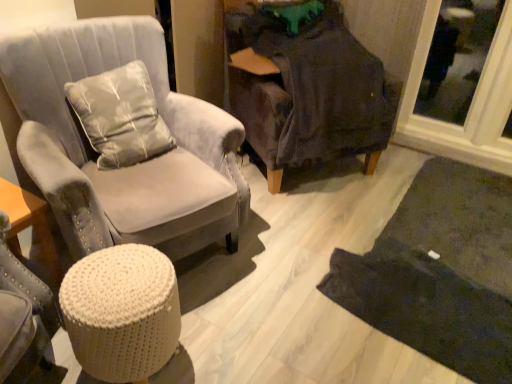
Question: Which direction should I rotate to look at dark gray fabric chair at center, marked as the 1th chair in a right-to-left arrangement, — up or down?

Choices:
 (A) up
 (B) down

Answer: (A)

Question: Can you confirm if white knitted stool at lower left is shorter than satin-like gray pillow at upper left?

Choices:
 (A) yes
 (B) no

Answer: (A)

Question: From a real-world perspective, is white knitted stool at lower left positioned under satin-like gray pillow at upper left based on gravity?

Choices:
 (A) no
 (B) yes

Answer: (B)

Question: Is white knitted stool at lower left to the left of satin-like gray pillow at upper left from the viewer's perspective?

Choices:
 (A) yes
 (B) no

Answer: (B)

Question: Is white knitted stool at lower left aimed at satin-like gray pillow at upper left?

Choices:
 (A) yes
 (B) no

Answer: (B)

Question: Can you confirm if white knitted stool at lower left is bigger than satin-like gray pillow at upper left?

Choices:
 (A) yes
 (B) no

Answer: (B)

Question: Considering the relative sizes of white knitted stool at lower left and satin-like gray pillow at upper left in the image provided, is white knitted stool at lower left thinner than satin-like gray pillow at upper left?

Choices:
 (A) yes
 (B) no

Answer: (B)

Question: Is transparent glass door at upper right located outside satin-like gray pillow at upper left?

Choices:
 (A) no
 (B) yes

Answer: (B)

Question: Is there a large distance between transparent glass door at upper right and satin-like gray pillow at upper left?

Choices:
 (A) yes
 (B) no

Answer: (A)

Question: Can you confirm if transparent glass door at upper right is thinner than satin-like gray pillow at upper left?

Choices:
 (A) yes
 (B) no

Answer: (A)

Question: Could you tell me if transparent glass door at upper right is facing satin-like gray pillow at upper left?

Choices:
 (A) no
 (B) yes

Answer: (A)

Question: Is transparent glass door at upper right looking in the opposite direction of satin-like gray pillow at upper left?

Choices:
 (A) yes
 (B) no

Answer: (B)

Question: Is satin-like gray pillow at upper left located within transparent glass door at upper right?

Choices:
 (A) yes
 (B) no

Answer: (B)

Question: From the image's perspective, is satin-like gray pillow at upper left located above dark gray fabric chair at center, marked as the 1th chair in a right-to-left arrangement?

Choices:
 (A) yes
 (B) no

Answer: (B)